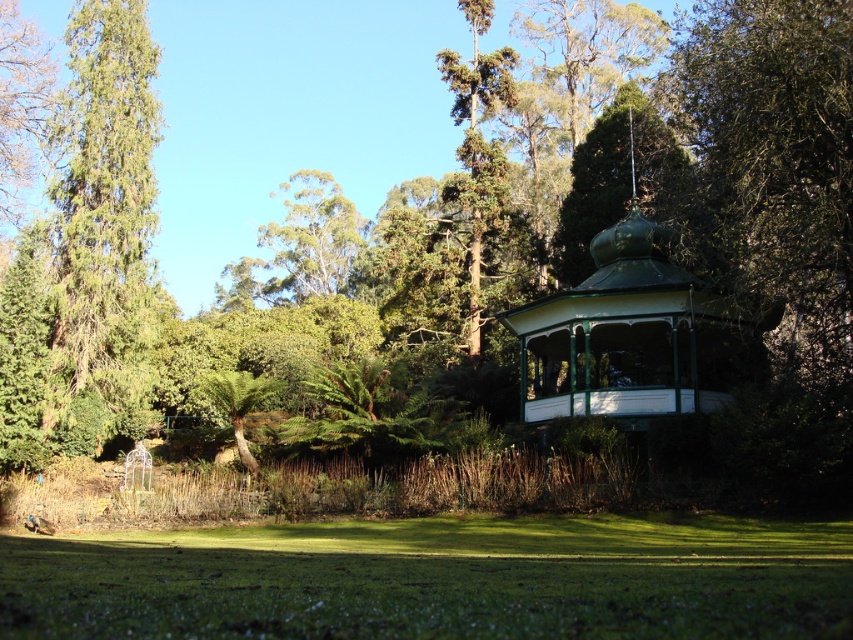
You are standing in the serene outdoor scene described. You notice a point marked at coordinates (630,298). What object does this point correspond to?

The point at coordinates (630,298) corresponds to the green painted wood gazebo at center right.

You are standing in the serene outdoor scene and want to take a photo of the green grassy field at lower center and the green textured tree at left. Which object should you focus on first if you want to capture both in a single frame without moving the camera?

You should focus on the green textured tree at left first because it is larger and will require more attention to ensure it fits properly in the frame, while the smaller green grassy field at lower center can be positioned within the remaining space.